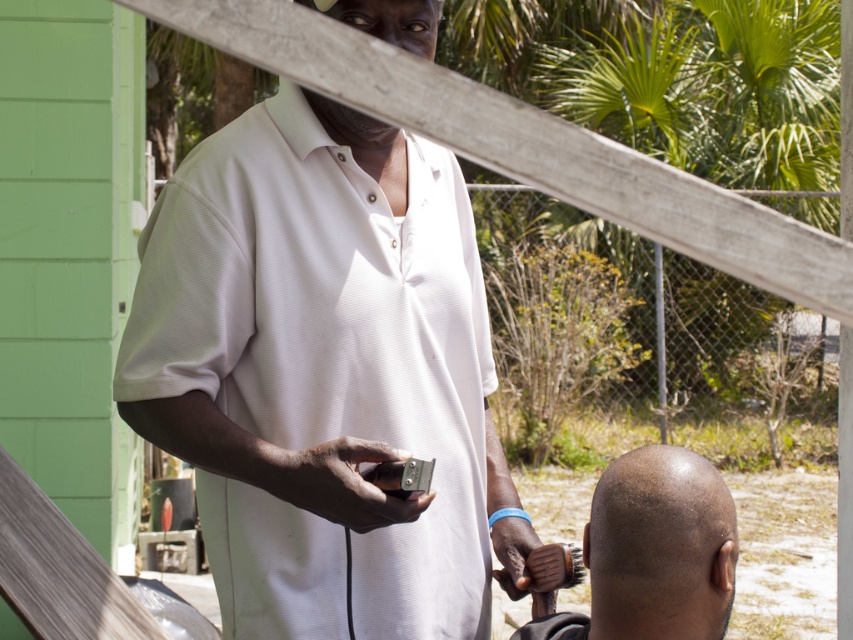
You are a photographer standing at the back of the scene. You want to take a photo of the bald head at center without the white matte shirt at center blocking it. Is it possible to adjust your position to achieve this?

The bald head at center is behind the white matte shirt at center, so adjusting your position might not help as the shirt wearer is in front. To capture the bald head at center without obstruction, you may need to move closer or have the subjects reposition themselves.